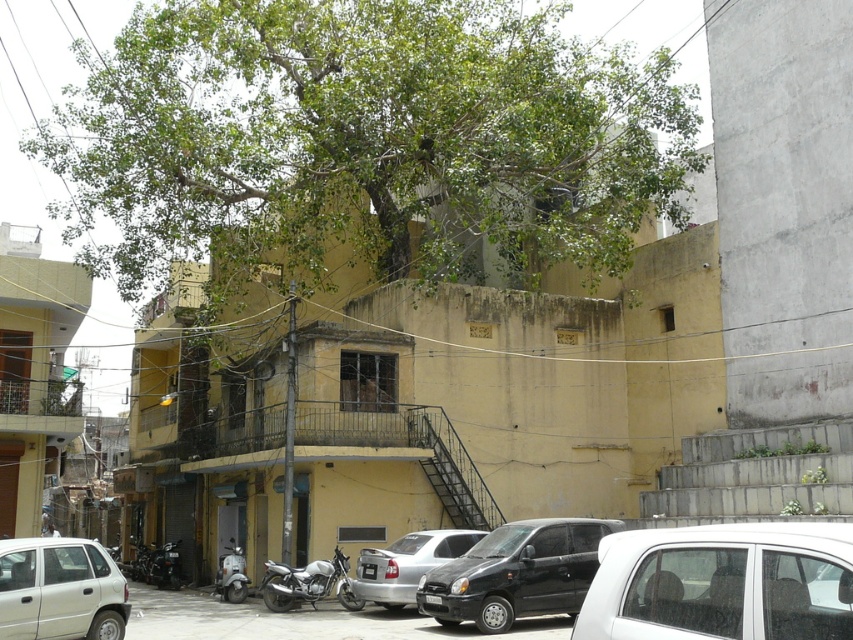
Question: Which point is farther to the camera?

Choices:
 (A) white glossy car at lower right
 (B) silver metallic motorcycle at center
 (C) matte black car at center
 (D) white matte suv at lower left

Answer: (B)

Question: Is matte black car at center wider than metallic silver scooter at lower left?

Choices:
 (A) no
 (B) yes

Answer: (B)

Question: Does green leafy tree at upper center appear under white matte suv at lower left?

Choices:
 (A) no
 (B) yes

Answer: (A)

Question: Based on their relative distances, which object is nearer to the white glossy car at center?

Choices:
 (A) white matte suv at lower left
 (B) silver metallic motorcycle at center

Answer: (A)

Question: Is green leafy tree at upper center below metallic silver scooter at lower left?

Choices:
 (A) yes
 (B) no

Answer: (B)

Question: Among these objects, which one is farthest from the camera?

Choices:
 (A) green leafy tree at upper center
 (B) matte black car at center

Answer: (A)